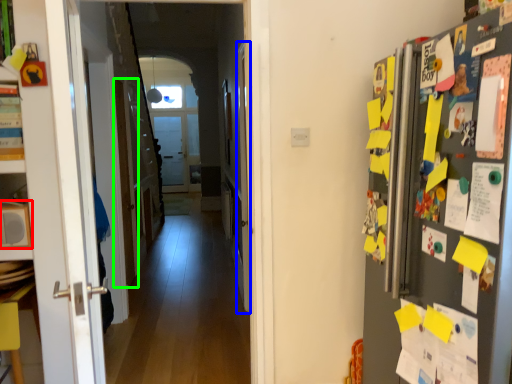
Question: Which is nearer to the appliance (highlighted by a red box)? door (highlighted by a blue box) or door (highlighted by a green box).

Choices:
 (A) door
 (B) door

Answer: (A)